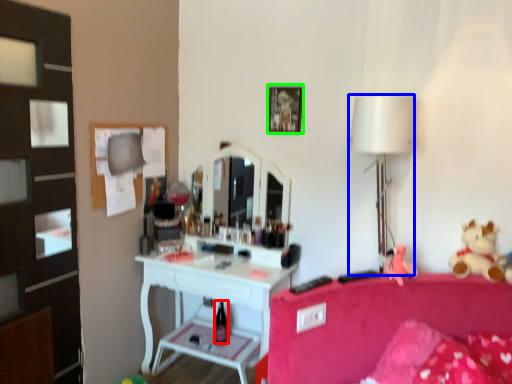
Question: Estimate the real-world distances between objects in this image. Which object is closer to bottle (highlighted by a red box), lamp (highlighted by a blue box) or picture frame (highlighted by a green box)?

Choices:
 (A) lamp
 (B) picture frame

Answer: (B)